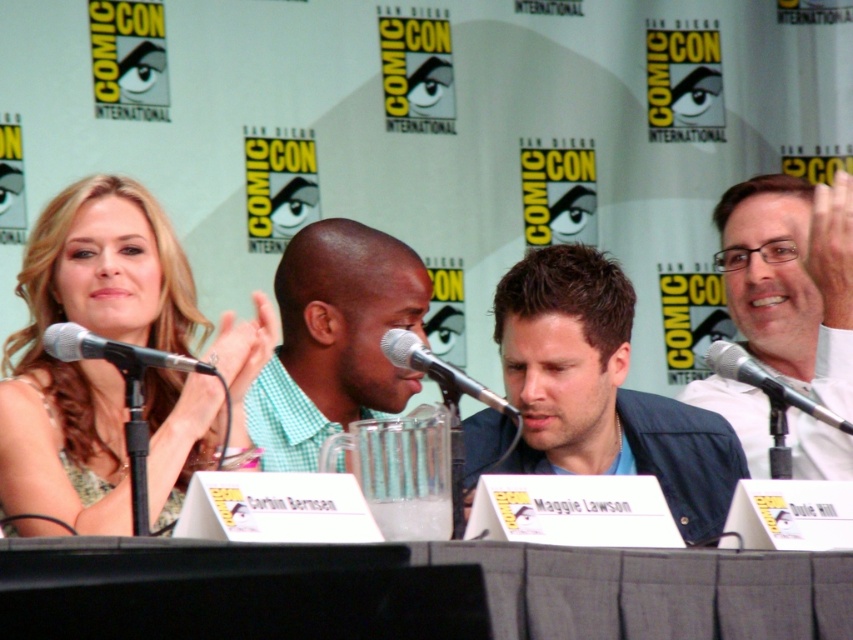
Question: Which object is closer to the camera taking this photo?

Choices:
 (A) black metallic microphone at left
 (B) gray fabric table at center
 (C) silver metallic microphone at center

Answer: (B)

Question: Among these objects, which one is nearest to the camera?

Choices:
 (A) white shirt at right
 (B) dark blue jacket at center

Answer: (B)

Question: Is dark blue jacket at center below black metallic microphone at left?

Choices:
 (A) yes
 (B) no

Answer: (A)

Question: Is dark blue jacket at center smaller than white shirt at right?

Choices:
 (A) yes
 (B) no

Answer: (B)

Question: Based on their relative distances, which object is farther from the dark blue jacket at center?

Choices:
 (A) green checkered shirt at center
 (B) black metallic microphone at left
 (C) silver metallic microphone at center
 (D) gray fabric table at center

Answer: (D)

Question: Considering the relative positions of metallic silver microphone at center and silver metallic microphone at center in the image provided, where is metallic silver microphone at center located with respect to silver metallic microphone at center?

Choices:
 (A) below
 (B) above

Answer: (B)